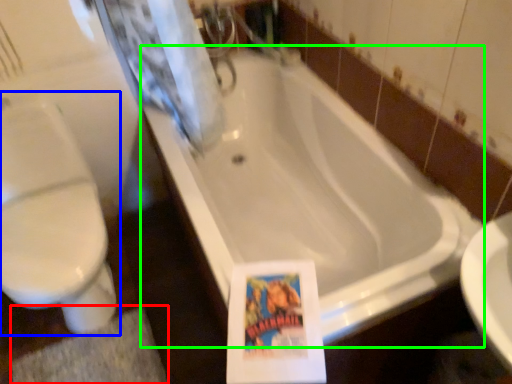
Question: Which is nearer to the bath mat (highlighted by a red box)? toilet (highlighted by a blue box) or bathtub (highlighted by a green box).

Choices:
 (A) toilet
 (B) bathtub

Answer: (A)